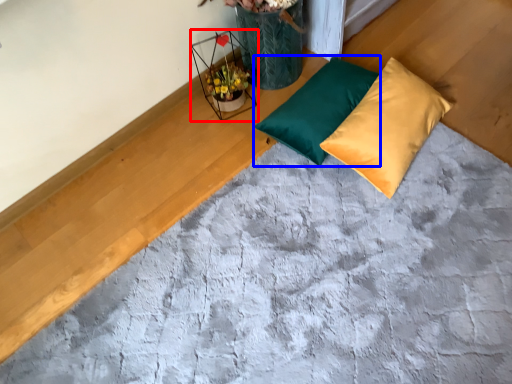
Question: Which object appears farthest to the camera in this image, flower basket (highlighted by a red box) or pillow (highlighted by a blue box)?

Choices:
 (A) flower basket
 (B) pillow

Answer: (A)